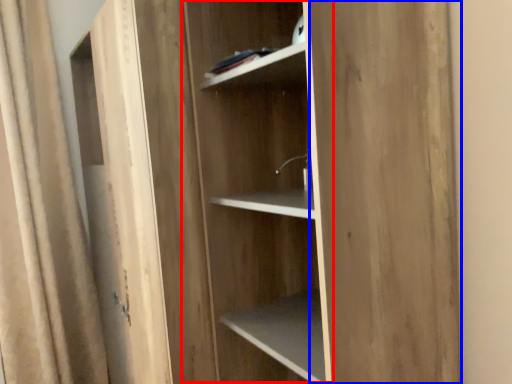
Question: Which object is closer to the camera taking this photo, cabinetry (highlighted by a red box) or plywood (highlighted by a blue box)?

Choices:
 (A) cabinetry
 (B) plywood

Answer: (B)